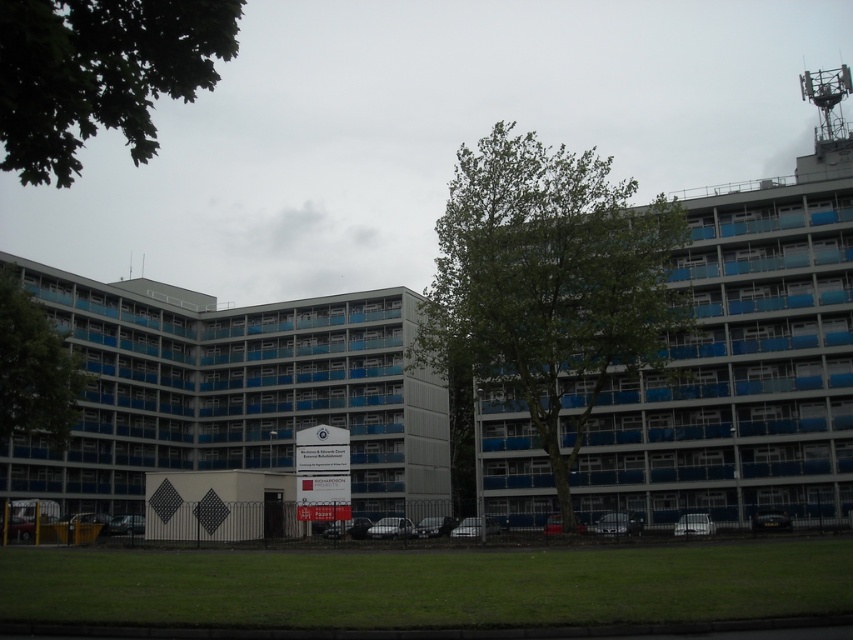
Question: Observing the image, what is the correct spatial positioning of green leafy tree at center in reference to green leafy tree at upper left?

Choices:
 (A) below
 (B) above

Answer: (B)

Question: Which point is closer to the camera?

Choices:
 (A) green leafy tree at upper left
 (B) green leafy tree at left
 (C) green leafy tree at center

Answer: (A)

Question: Among these points, which one is nearest to the camera?

Choices:
 (A) (57, 60)
 (B) (1, 333)

Answer: (A)

Question: Which of the following is the closest to the observer?

Choices:
 (A) green leafy tree at left
 (B) green leafy tree at center
 (C) green leafy tree at upper left

Answer: (C)

Question: Where is green leafy tree at center located in relation to green leafy tree at left in the image?

Choices:
 (A) left
 (B) right

Answer: (B)

Question: Where is green leafy tree at center located in relation to green leafy tree at left in the image?

Choices:
 (A) left
 (B) right

Answer: (B)